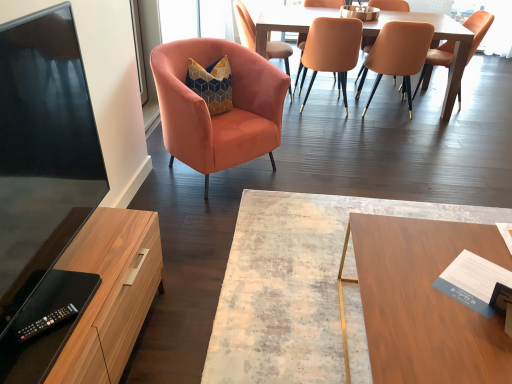
Image resolution: width=512 pixels, height=384 pixels. What are the coordinates of `vacant area that lies between matte orange chair at upper center, the 2th chair when ordered from right to left, and wooden rectangular table at center` in the screenshot? It's located at pos(371,159).